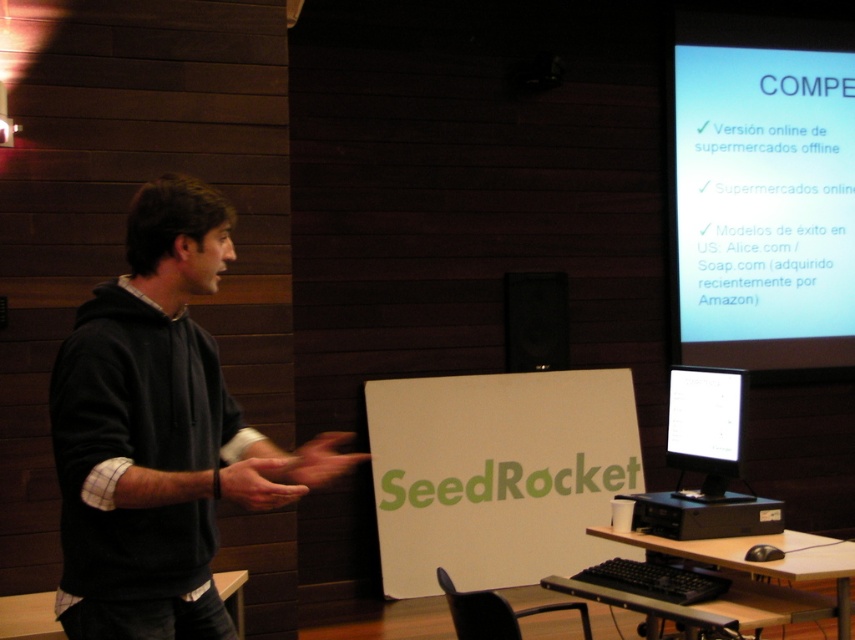
Which is behind, point (759, 285) or point (776, 522)?

Point (759, 285)

Which is more to the right, white glossy projector screen at upper right or black plastic monitor at lower right?

Positioned to the right is white glossy projector screen at upper right.

Which is in front, point (820, 209) or point (752, 520)?

Point (752, 520) is in front.

The width and height of the screenshot is (855, 640). In order to click on white glossy projector screen at upper right in this screenshot , I will do `click(762, 198)`.

Is dark gray hoodie at left taller than matte black monitor at center?

Yes, dark gray hoodie at left is taller than matte black monitor at center.

Does dark gray hoodie at left have a larger size compared to matte black monitor at center?

Yes, dark gray hoodie at left is bigger than matte black monitor at center.

Which is in front, point (196, 637) or point (670, 406)?

Point (196, 637) is in front.

At what (x,y) coordinates should I click in order to perform the action: click on dark gray hoodie at left. Please return your answer as a coordinate pair (x, y). Looking at the image, I should click on (158, 433).

Between dark gray hoodie at left and white glossy projector screen at upper right, which one is positioned lower?

dark gray hoodie at left is lower down.

Can you confirm if dark gray hoodie at left is shorter than white glossy projector screen at upper right?

Indeed, dark gray hoodie at left has a lesser height compared to white glossy projector screen at upper right.

Between point (80, 424) and point (677, 122), which one is positioned in front?

Point (80, 424) is more forward.

Locate an element on the screen. dark gray hoodie at left is located at coordinates (158, 433).